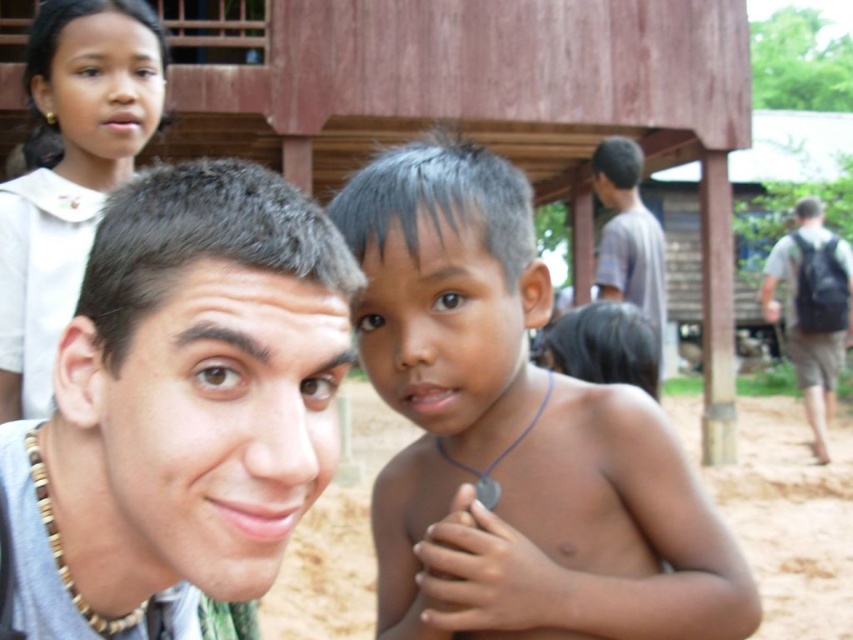
What do you see at coordinates (70, 176) in the screenshot?
I see `white satin shirt at upper left` at bounding box center [70, 176].

Who is more forward, (67, 26) or (830, 324)?

Positioned in front is point (67, 26).

The height and width of the screenshot is (640, 853). I want to click on white satin shirt at upper left, so click(x=70, y=176).

Can you confirm if brown skin/smooth skin/child at center is thinner than white satin shirt at upper left?

No, brown skin/smooth skin/child at center is not thinner than white satin shirt at upper left.

Locate an element on the screen. brown skin/smooth skin/child at center is located at coordinates (514, 433).

Is point (511, 326) positioned in front of point (13, 204)?

Yes, point (511, 326) is in front of point (13, 204).

This screenshot has height=640, width=853. I want to click on brown skin/smooth skin/child at center, so click(x=514, y=433).

Is light brown hair at center further to camera compared to black backpack at right?

No.

Locate an element on the screen. The height and width of the screenshot is (640, 853). light brown hair at center is located at coordinates (196, 376).